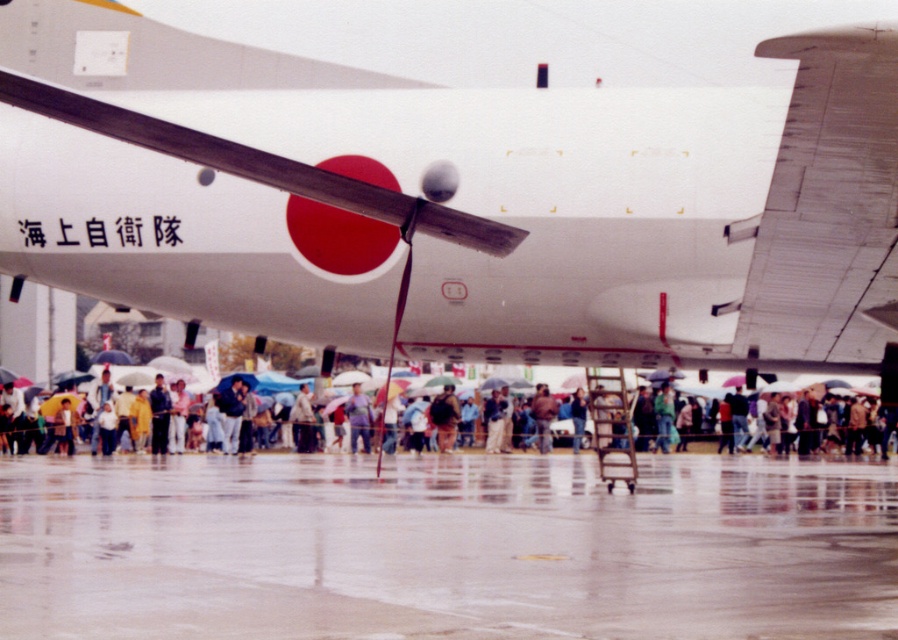
Question: Which of the following is the farthest from the observer?

Choices:
 (A) glossy concrete tarmac at lower center
 (B) metallic gray wing at upper right
 (C) dark brown leather jacket at center

Answer: (C)

Question: Which object appears farthest from the camera in this image?

Choices:
 (A) dark brown leather jacket at center
 (B) metallic gray wing at upper right
 (C) glossy concrete tarmac at lower center

Answer: (A)

Question: Does metallic gray wing at upper right appear on the left side of dark brown leather jacket at center?

Choices:
 (A) yes
 (B) no

Answer: (B)

Question: Does metallic gray wing at upper right lie behind dark brown leather jacket at center?

Choices:
 (A) yes
 (B) no

Answer: (B)

Question: Which object is farther from the camera taking this photo?

Choices:
 (A) dark brown leather jacket at center
 (B) metallic gray wing at upper right
 (C) glossy concrete tarmac at lower center

Answer: (A)

Question: In this image, where is white matte airplane at center located relative to dark brown leather jacket at center?

Choices:
 (A) above
 (B) below

Answer: (A)